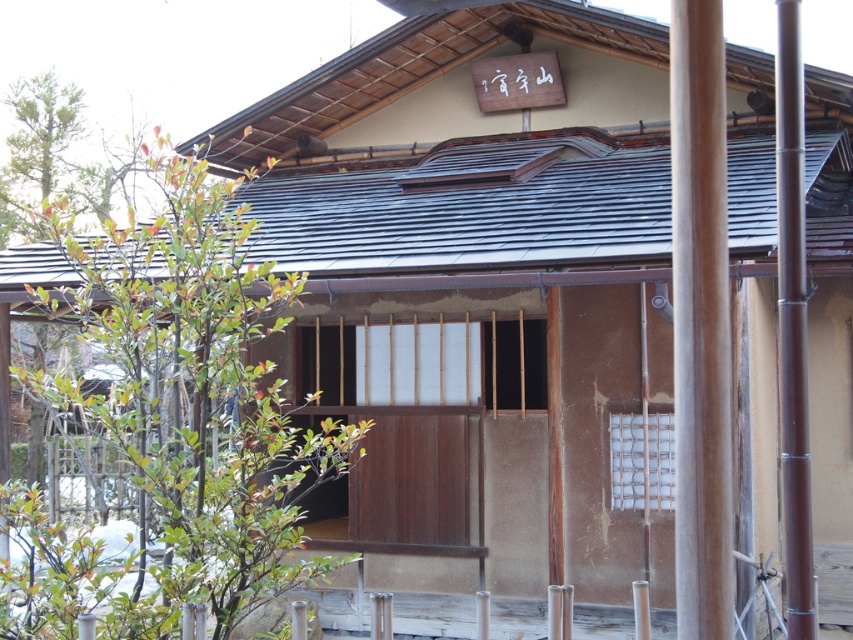
You are an architect designing a garden path that needs to pass between the brown wood pole at right and the brown bamboo pole at right. The path must be wide enough for a wheelchair to pass comfortably. Can you determine if the space between them is sufficient?

The brown wood pole at right has a lesser height compared to brown bamboo pole at right, but the description does not provide information about the distance between them. Therefore, it is impossible to determine if the space between them is sufficient for a wheelchair path based on the given information.

You are a delivery person standing at the entrance of the traditional Japanese building. You need to place a package that is 10 feet long between the brown wood pole at right and another structure. Is there enough space?

The distance between the brown wood pole at right and the other structure is 13.77 feet, which is more than enough to accommodate the 10 feet long package.

In the scene shown: You are standing in front of the traditional Japanese building and need to locate the brown wood pole at right. Based on the coordinates provided, where exactly would you find it relative to the building?

The brown wood pole at right is located at point coordinates 0.505 on the x and 0.822 on the y axis, which places it on the right side of the building near the lower part of the structure.